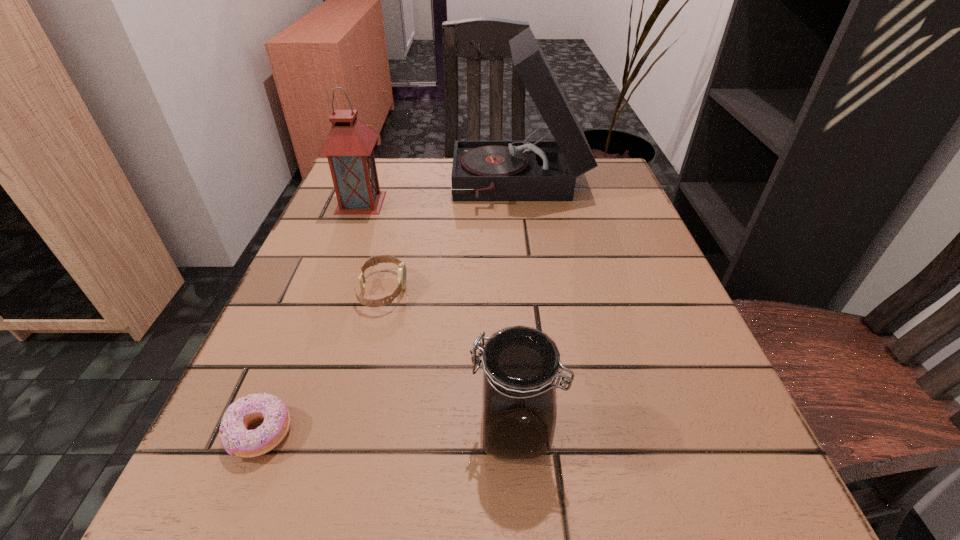
Identify the location of vacant space that satisfies the following two spatial constraints: 1. on the lid of the third shortest object; 2. on the front side of the shortest object. tap(515, 433).

The width and height of the screenshot is (960, 540). Identify the location of free location that satisfies the following two spatial constraints: 1. on the front-facing side of the phonograph_record; 2. on the front side of the doughnut. (553, 433).